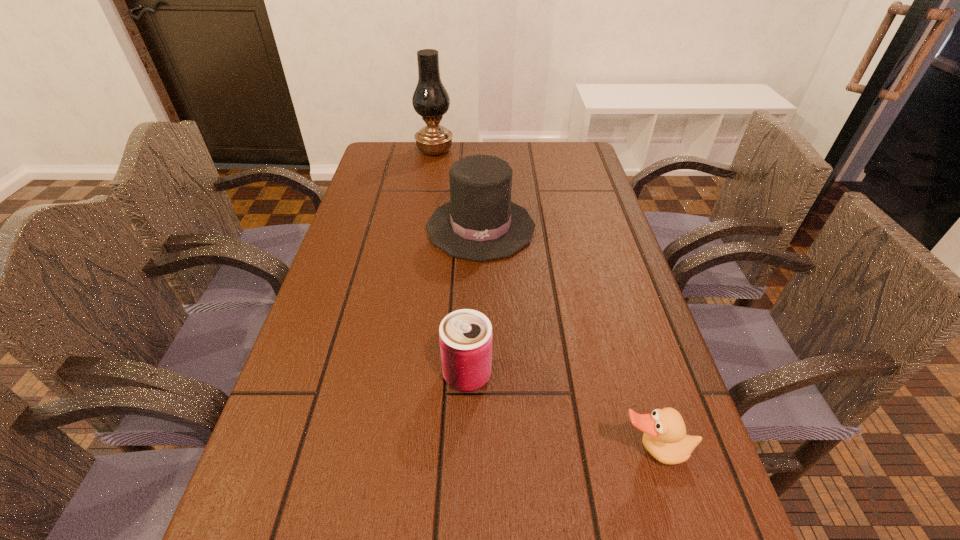
Identify the location of oil lamp. This screenshot has height=540, width=960. point(430,100).

At what (x,y) coordinates should I click in order to perform the action: click on the tallest object. Please return your answer as a coordinate pair (x, y). The image size is (960, 540). Looking at the image, I should click on (430, 100).

Where is `the third nearest object`? the third nearest object is located at coordinates (480, 223).

The image size is (960, 540). I want to click on the third shortest object, so click(480, 223).

Identify the location of the third tallest object. (465, 336).

At what (x,y) coordinates should I click in order to perform the action: click on can. Please return your answer as a coordinate pair (x, y). This screenshot has height=540, width=960. Looking at the image, I should click on (465, 336).

Identify the location of the nearest object. Image resolution: width=960 pixels, height=540 pixels. (665, 438).

Identify the location of the rightmost object. (665, 438).

Locate an element on the screen. Image resolution: width=960 pixels, height=540 pixels. free space located on the right of the tallest object is located at coordinates (515, 150).

This screenshot has height=540, width=960. Identify the location of vacant region located on the front of the third shortest object with the decoration. (481, 325).